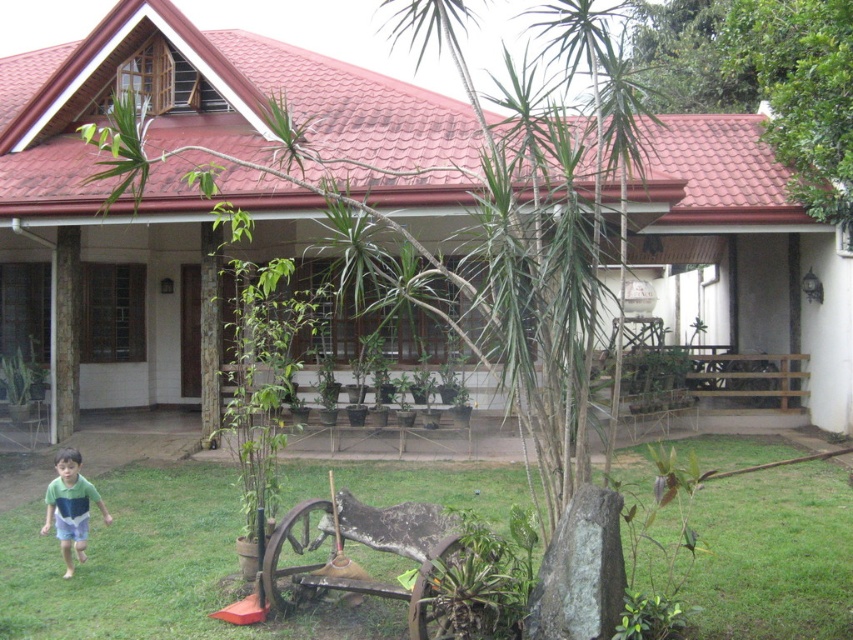
You are standing at the center of the image and want to walk towards the green grass at lower left. In which direction should you move relative to the house?

The green grass at lower left is located at point [151,566], which means you should move towards the lower left direction relative to the house to reach it.

You are a gardener who needs to water the green grass at lower left and the green cotton shirt at lower left. Which object is closer to you if you are standing at the center of the lawn?

The green grass at lower left is closer to you than the green cotton shirt at lower left because the distance between them is 3.63 feet, implying the shirt is farther away from the grass than the grass itself.